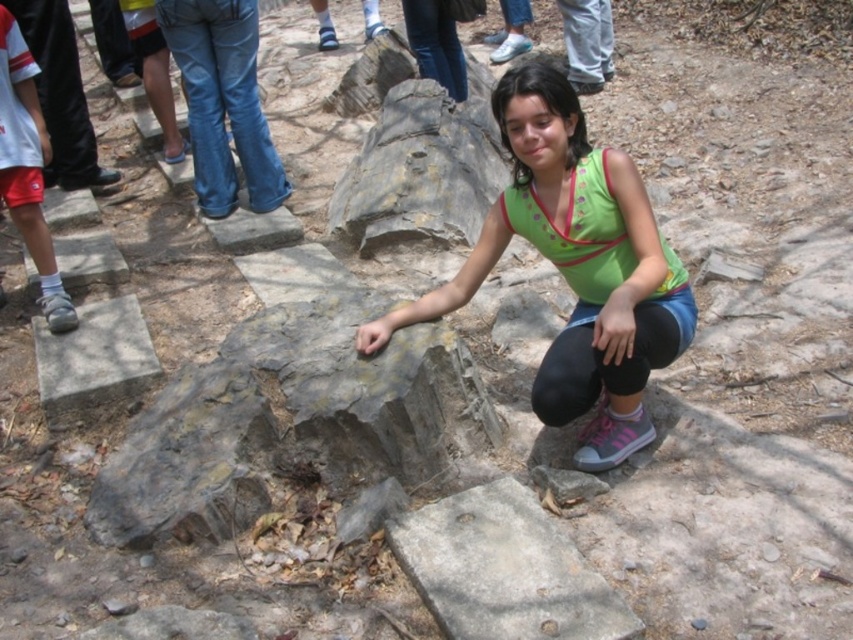
You are a photographer trying to capture the girl in the green fabric shirt at center and the gray rough stone at lower center in a single frame. Based on their positions, which object is located to the right of the other?

The green fabric shirt at center is positioned on the right side of gray rough stone at lower center.

You are standing at the bottom of the stone steps and see the green fabric shirt at center and the gray concrete block at lower left. Which object is closer to you?

The gray concrete block at lower left is closer to you because it is positioned under the green fabric shirt at center, indicating it is lower in the scene.